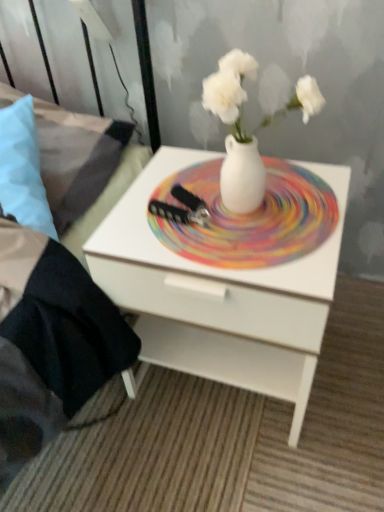
Question: From a real-world perspective, is brushed metal bed frame at left physically located above or below white matte vase at center?

Choices:
 (A) below
 (B) above

Answer: (A)

Question: Considering their positions, is brushed metal bed frame at left located in front of or behind white matte vase at center?

Choices:
 (A) front
 (B) behind

Answer: (B)

Question: Considering the real-world distances, which object is farthest from the white glossy plate at center?

Choices:
 (A) white glossy nightstand at center
 (B) white matte vase at center
 (C) brushed metal bed frame at left
 (D) light blue fabric pillow at left

Answer: (D)

Question: Estimate the real-world distances between objects in this image. Which object is farther from the white glossy nightstand at center?

Choices:
 (A) brushed metal bed frame at left
 (B) white matte vase at center
 (C) white glossy plate at center
 (D) light blue fabric pillow at left

Answer: (D)